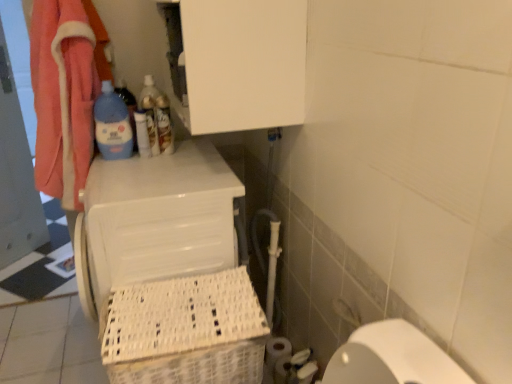
What are the coordinates of `vacant space to the right of translucent plastic bottle at upper center, positioned as the first bottle in right-to-left order` in the screenshot? It's located at (195, 150).